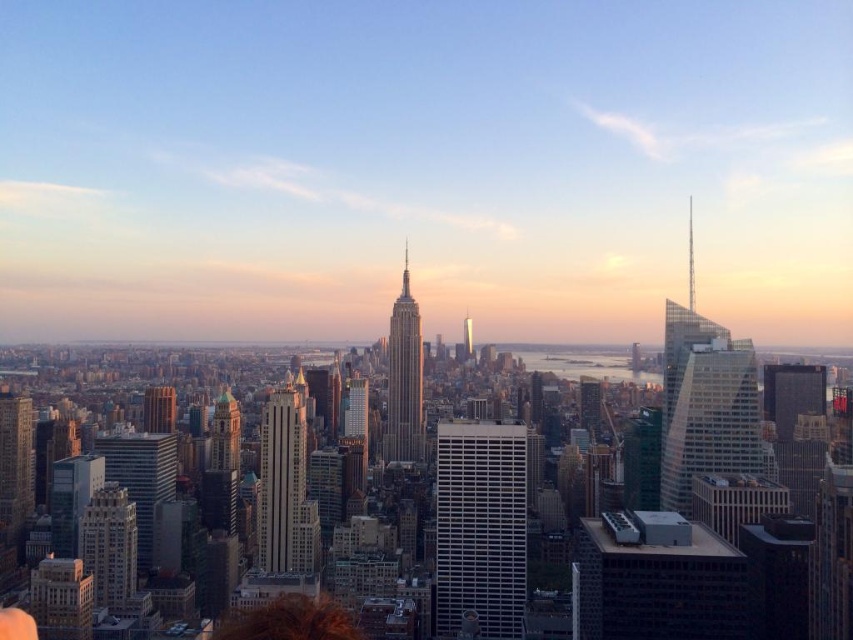
Can you confirm if clear glass skyscraper at right is smaller than gold textured building at lower left?

Incorrect, clear glass skyscraper at right is not smaller in size than gold textured building at lower left.

From the picture: Who is more forward, (741, 344) or (83, 509)?

Point (741, 344) is in front.

Who is more distant from viewer, (718, 449) or (102, 522)?

The point (102, 522) is behind.

Find the location of `clear glass skyscraper at right`. clear glass skyscraper at right is located at coordinates (705, 404).

Which is in front, point (683, 429) or point (415, 452)?

Point (415, 452)

Which is above, clear glass skyscraper at right or gold reflective tower at center?

gold reflective tower at center

Is point (679, 312) in front of point (399, 364)?

No, it is not.

Image resolution: width=853 pixels, height=640 pixels. Find the location of `clear glass skyscraper at right`. clear glass skyscraper at right is located at coordinates (705, 404).

Is brick textured building at lower left taller than shiny silver skyscraper at center?

Yes, brick textured building at lower left is taller than shiny silver skyscraper at center.

Who is shorter, brick textured building at lower left or shiny silver skyscraper at center?

Standing shorter between the two is shiny silver skyscraper at center.

Is point (166, 388) in front of point (463, 336)?

No.

You are a GUI agent. You are given a task and a screenshot of the screen. Output one action in this format:
    pyautogui.click(x=<x>, y=<y>)
    Task: Click on the brick textured building at lower left
    
    Given the screenshot: What is the action you would take?
    pyautogui.click(x=160, y=410)